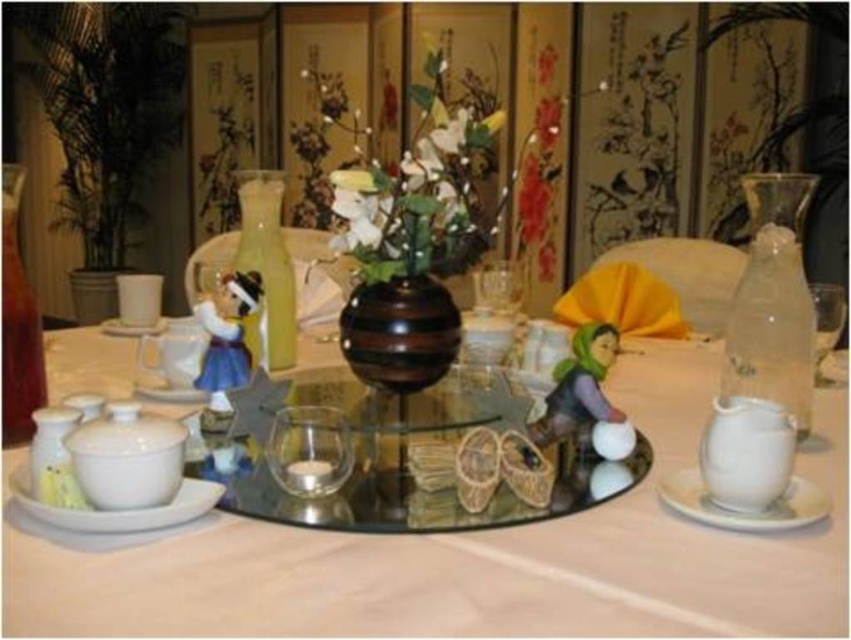
Is point (777, 266) positioned behind point (107, 525)?

That is True.

Is point (722, 396) positioned in front of point (98, 512)?

No, (722, 396) is further to viewer.

Image resolution: width=851 pixels, height=640 pixels. What are the coordinates of `clear glass bottle at right` in the screenshot? It's located at (770, 328).

Measure the distance between point (429, 211) and camera.

They are 30.23 inches apart.

Is matte brown vase at center positioned at the back of white matte saucer at lower left?

Yes, it is behind white matte saucer at lower left.

Is point (414, 220) closer to viewer compared to point (218, 493)?

No, (414, 220) is behind (218, 493).

I want to click on matte brown vase at center, so click(417, 182).

Is clear glass bottle at right above translucent glass vase at center?

Incorrect, clear glass bottle at right is not positioned above translucent glass vase at center.

Based on the photo, measure the distance between clear glass bottle at right and camera.

clear glass bottle at right is 60.36 centimeters away from camera.

Does point (781, 308) come in front of point (261, 348)?

Yes, it is.

Locate an element on the screen. clear glass bottle at right is located at coordinates (770, 328).